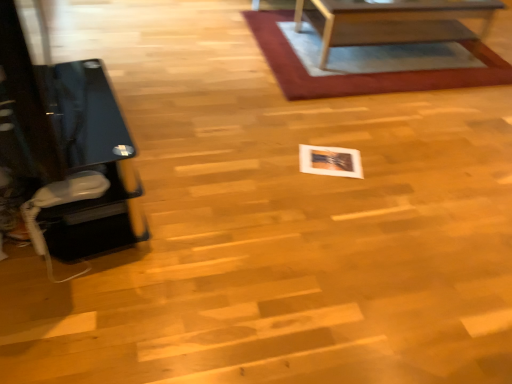
In order to click on free space in front of white glossy photo frame at center in this screenshot , I will do `click(328, 192)`.